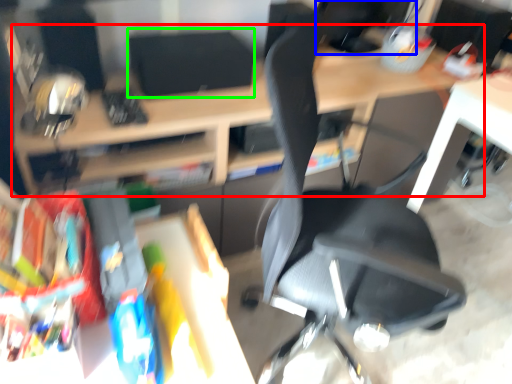
Question: Which object is the farthest from desk (highlighted by a red box)? Choose among these: computer monitor (highlighted by a blue box) or computer monitor (highlighted by a green box).

Choices:
 (A) computer monitor
 (B) computer monitor

Answer: (A)